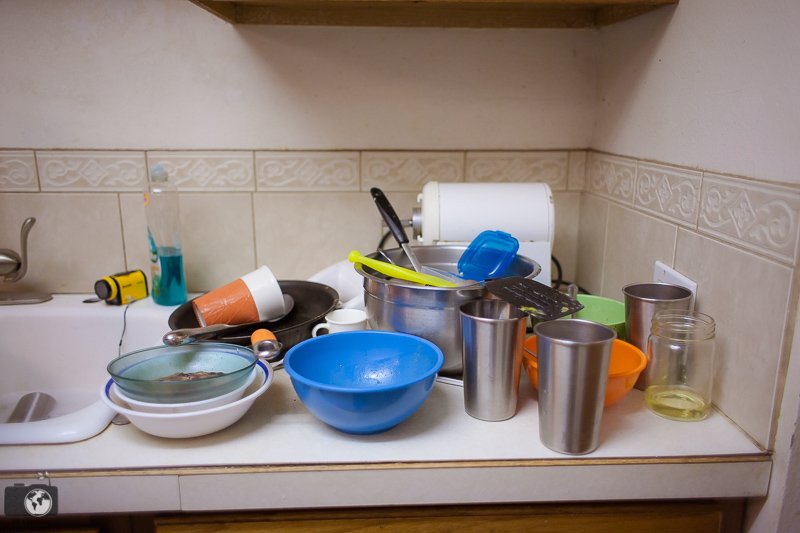
This screenshot has width=800, height=533. Find the location of `bowls`. bowls is located at coordinates (186, 428), (188, 408), (192, 383), (340, 392), (604, 313), (613, 368).